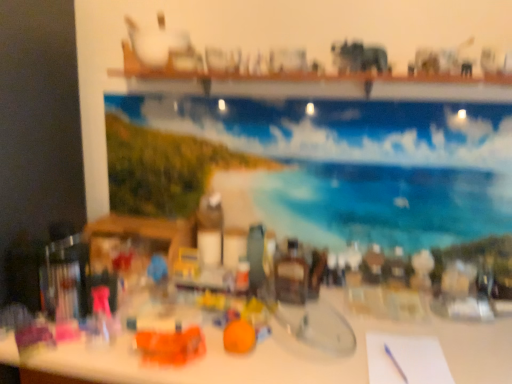
The image size is (512, 384). In order to click on vacant area that is situated to the right of white paper at lower right in this screenshot , I will do `click(471, 357)`.